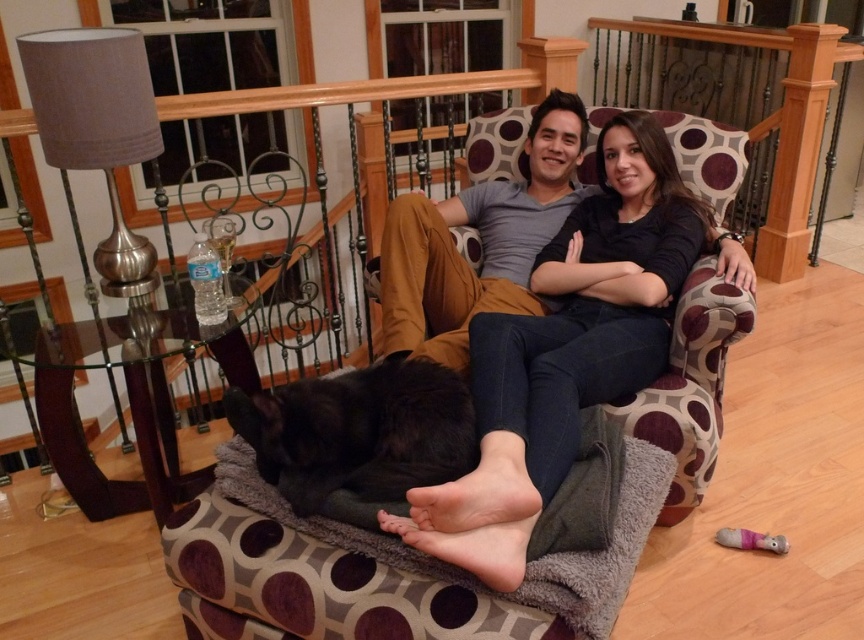
From the picture: You are planning to place a rectangular pillow that is 20 cm wide between the dark blue jeans at center and the soft gray fabric dog bed at center. Can the pillow fit horizontally between them?

The dark blue jeans at center is narrower than the soft gray fabric dog bed at center. However, the exact distance between them isn t specified in the Objects Description. The pillow s width is 20 cm, but without knowing the space between the two items, it s impossible to determine if it will fit.

You are a pet owner who wants to place your black fluffy dog at center on the soft gray fabric dog bed at center. Based on the scene description, will the dog fit comfortably on the bed?

The soft gray fabric dog bed at center is wider than the black fluffy dog at center, so the dog should fit comfortably on the bed.

You are a photographer setting up for a family photo. You notice the soft gray fabric dog bed at center and the matte gray shirt at center in the scene. Which object is closer to the camera?

The soft gray fabric dog bed at center is closer to the camera since it is in front of the matte gray shirt at center.